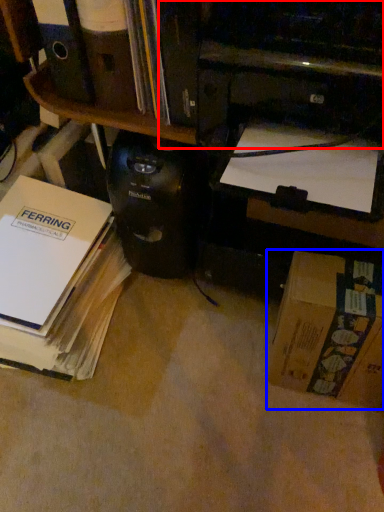
Question: Which of the following is the closest to the observer, printer (highlighted by a red box) or box (highlighted by a blue box)?

Choices:
 (A) printer
 (B) box

Answer: (A)